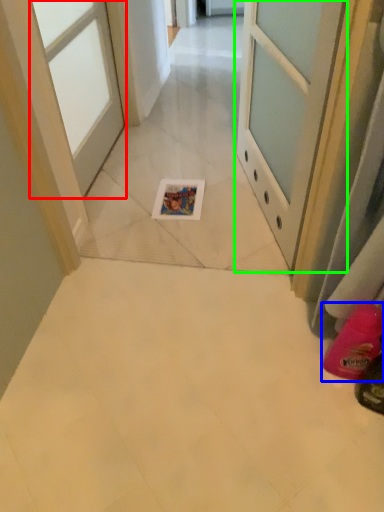
Question: Considering the real-world distances, which object is farthest from door (highlighted by a red box)? footwear (highlighted by a blue box) or door (highlighted by a green box)?

Choices:
 (A) footwear
 (B) door

Answer: (A)